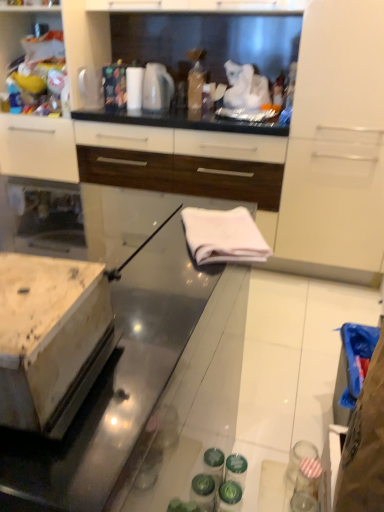
Question: Considering the positions of white glossy towel at center and white glossy cabinet at upper left, the second cabinetry viewed from the right, in the image, is white glossy towel at center wider or thinner than white glossy cabinet at upper left, the second cabinetry viewed from the right,?

Choices:
 (A) wide
 (B) thin

Answer: (A)

Question: From a real-world perspective, is white glossy towel at center physically located above or below white glossy cabinet at upper left, arranged as the 1th cabinetry when viewed from the left?

Choices:
 (A) below
 (B) above

Answer: (A)

Question: Which object is the farthest from the white glossy cabinet at upper left, arranged as the 1th cabinetry when viewed from the left?

Choices:
 (A) white glossy towel at center
 (B) white glossy cabinet at upper center, the 1th cabinetry from the right
 (C) white glossy electric kettle at upper center
 (D) white fabric at center

Answer: (D)

Question: Which object is positioned farthest from the white fabric at center?

Choices:
 (A) white glossy electric kettle at upper center
 (B) white glossy cabinet at upper left, the second cabinetry viewed from the right
 (C) white glossy cabinet at upper center, which appears as the 2th cabinetry when viewed from the left
 (D) white glossy towel at center

Answer: (B)